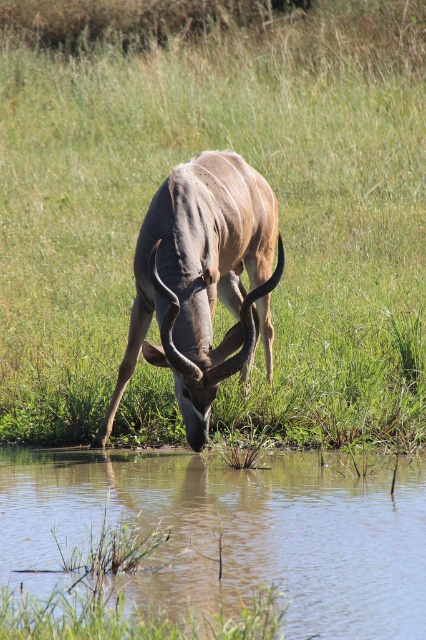
Question: Can you confirm if green grass at center is positioned below grayish-brown horned animal at center?

Choices:
 (A) yes
 (B) no

Answer: (B)

Question: Is clear water at lower center wider than grayish-brown horned animal at center?

Choices:
 (A) no
 (B) yes

Answer: (B)

Question: Which of these objects is positioned closest to the green grass at center?

Choices:
 (A) grayish-brown horned animal at center
 (B) clear water at lower center

Answer: (A)

Question: Which point appears closest to the camera in this image?

Choices:
 (A) (420, 257)
 (B) (420, 616)
 (C) (230, 241)

Answer: (B)

Question: Can you confirm if clear water at lower center is positioned to the right of grayish-brown horned animal at center?

Choices:
 (A) no
 (B) yes

Answer: (A)

Question: Which of the following is the farthest from the observer?

Choices:
 (A) (242, 56)
 (B) (307, 451)
 (C) (176, 266)

Answer: (A)